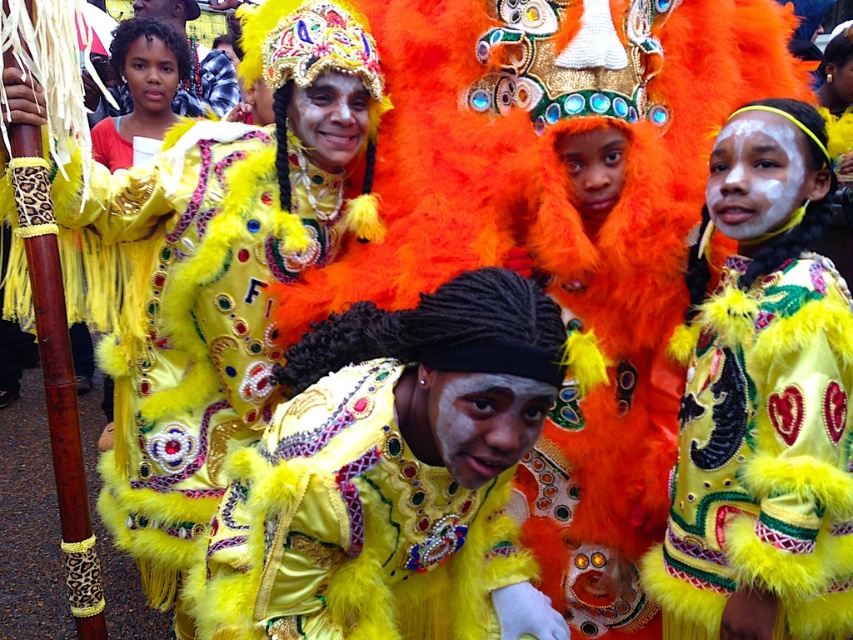
Question: Which point is farther to the camera?

Choices:
 (A) (135, 109)
 (B) (207, 532)

Answer: (A)

Question: Which of the following is the farthest from the observer?

Choices:
 (A) yellow fuzzy jacket at center
 (B) shiny yellow feathered costume at upper left
 (C) shiny yellow feathered outfit at center

Answer: (B)

Question: Does shiny yellow feathered outfit at center appear over yellow fuzzy jacket at center?

Choices:
 (A) yes
 (B) no

Answer: (B)

Question: Among these points, which one is farthest from the camera?

Choices:
 (A) (303, 452)
 (B) (688, 326)
 (C) (257, 198)
 (D) (183, 42)

Answer: (D)

Question: Is shiny yellow fur coat at center to the left of shiny yellow feathered costume at upper left from the viewer's perspective?

Choices:
 (A) yes
 (B) no

Answer: (B)

Question: Is shiny yellow feathered outfit at center closer to the viewer compared to yellow fuzzy jacket at center?

Choices:
 (A) yes
 (B) no

Answer: (A)